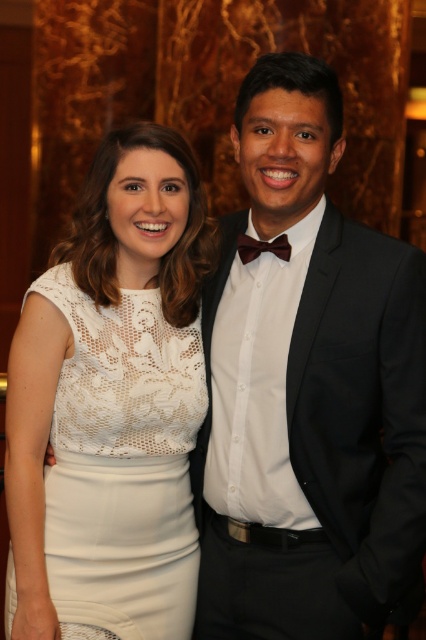
Can you confirm if lace fabric dress at center is positioned to the left of black wool suit at right?

Yes, lace fabric dress at center is to the left of black wool suit at right.

Does lace fabric dress at center lie in front of black wool suit at right?

No, it is not.

Locate an element on the screen. Image resolution: width=426 pixels, height=640 pixels. lace fabric dress at center is located at coordinates (123, 465).

Locate an element on the screen. The width and height of the screenshot is (426, 640). lace fabric dress at center is located at coordinates coord(123,465).

Between black wool suit at right and brown satin bow tie at center, which one has less height?

With less height is brown satin bow tie at center.

Find the location of `black wool suit at right`. black wool suit at right is located at coordinates (362, 410).

Identify the location of black wool suit at right. The width and height of the screenshot is (426, 640). (362, 410).

Which of these two, lace fabric dress at center or brown satin bow tie at center, stands shorter?

brown satin bow tie at center is shorter.

Is lace fabric dress at center to the left of brown satin bow tie at center from the viewer's perspective?

Yes, lace fabric dress at center is to the left of brown satin bow tie at center.

Describe the element at coordinates (123, 465) in the screenshot. I see `lace fabric dress at center` at that location.

Locate an element on the screen. lace fabric dress at center is located at coordinates (123, 465).